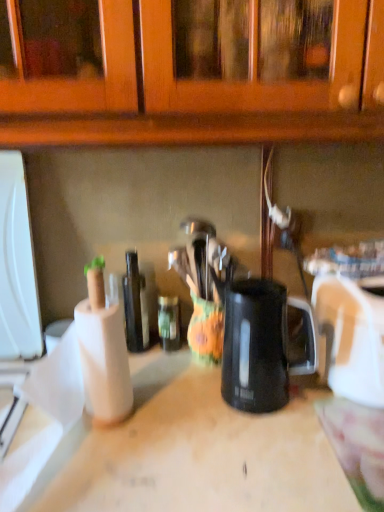
Question: From a real-world perspective, is shiny dark glass bottle at center, which is the first bottle from left to right, on white plastic toaster at right?

Choices:
 (A) yes
 (B) no

Answer: (A)

Question: Is shiny dark glass bottle at center, positioned as the second bottle in right-to-left order, in front of white plastic toaster at right?

Choices:
 (A) no
 (B) yes

Answer: (A)

Question: Can you confirm if shiny dark glass bottle at center, which is the first bottle from left to right, is wider than white plastic toaster at right?

Choices:
 (A) no
 (B) yes

Answer: (A)

Question: Is shiny dark glass bottle at center, which is the first bottle from left to right, smaller than white plastic toaster at right?

Choices:
 (A) no
 (B) yes

Answer: (B)

Question: Is shiny dark glass bottle at center, positioned as the second bottle in right-to-left order, oriented away from white plastic toaster at right?

Choices:
 (A) no
 (B) yes

Answer: (A)

Question: In terms of height, does black plastic mug at center look taller or shorter compared to shiny dark glass bottle at center, positioned as the second bottle in right-to-left order?

Choices:
 (A) tall
 (B) short

Answer: (B)

Question: From a real-world perspective, is black plastic mug at center above or below shiny dark glass bottle at center, positioned as the second bottle in right-to-left order?

Choices:
 (A) below
 (B) above

Answer: (A)

Question: Considering the positions of point (286, 298) and point (129, 306), is point (286, 298) closer or farther from the camera than point (129, 306)?

Choices:
 (A) farther
 (B) closer

Answer: (A)

Question: In terms of size, does black plastic mug at center appear bigger or smaller than shiny dark glass bottle at center, positioned as the second bottle in right-to-left order?

Choices:
 (A) small
 (B) big

Answer: (B)

Question: In terms of size, does green glass bottle at center, the 1th bottle positioned from the right, appear bigger or smaller than shiny dark glass bottle at center, which is the first bottle from left to right?

Choices:
 (A) big
 (B) small

Answer: (B)

Question: Is green glass bottle at center, the 1th bottle positioned from the right, situated inside shiny dark glass bottle at center, which is the first bottle from left to right, or outside?

Choices:
 (A) outside
 (B) inside

Answer: (A)

Question: From the image's perspective, is green glass bottle at center, the 1th bottle positioned from the right, located above or below shiny dark glass bottle at center, positioned as the second bottle in right-to-left order?

Choices:
 (A) above
 (B) below

Answer: (B)

Question: From a real-world perspective, is green glass bottle at center, the 1th bottle positioned from the right, positioned above or below shiny dark glass bottle at center, which is the first bottle from left to right?

Choices:
 (A) above
 (B) below

Answer: (B)

Question: Is shiny dark glass bottle at center, which is the first bottle from left to right, in front of or behind black plastic mug at center in the image?

Choices:
 (A) behind
 (B) front

Answer: (A)

Question: From a real-world perspective, is shiny dark glass bottle at center, which is the first bottle from left to right, physically located above or below black plastic mug at center?

Choices:
 (A) below
 (B) above

Answer: (B)